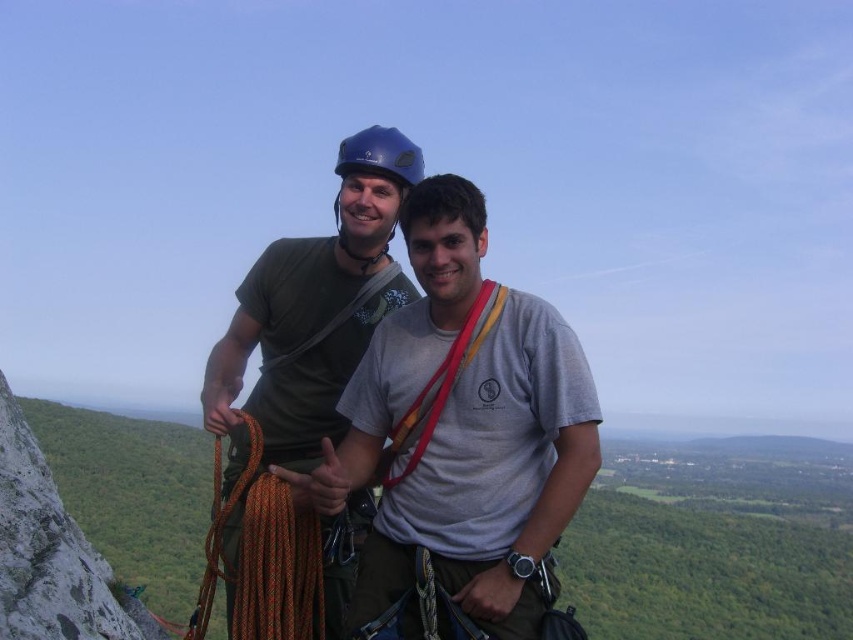
You are a photographer planning to take a picture of the matte green shirt at center. What are the coordinates where you should aim your camera?

The coordinates for the matte green shirt at center are at point (314, 305).

You are a photographer trying to capture a clear photo of the orange braided rope at center. The matte green shirt at center is blocking your view. Can you estimate whether the shirt is wider than the rope?

The matte green shirt at center might be wider than orange braided rope at center, so there is a possibility that the shirt is blocking the entire rope and making it hard to capture in the photo.